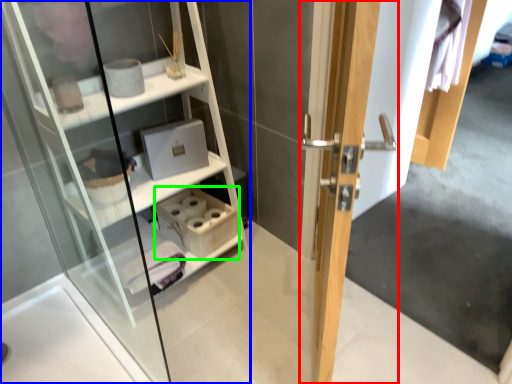
Question: Based on their relative distances, which object is nearer to door (highlighted by a red box)? Choose from shelf (highlighted by a blue box) and cabinet (highlighted by a green box).

Choices:
 (A) shelf
 (B) cabinet

Answer: (B)